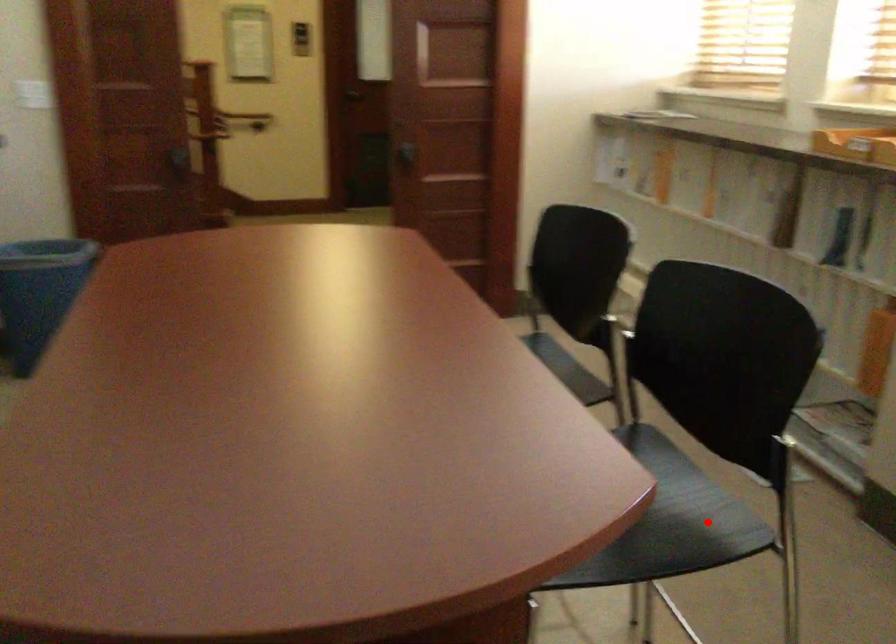
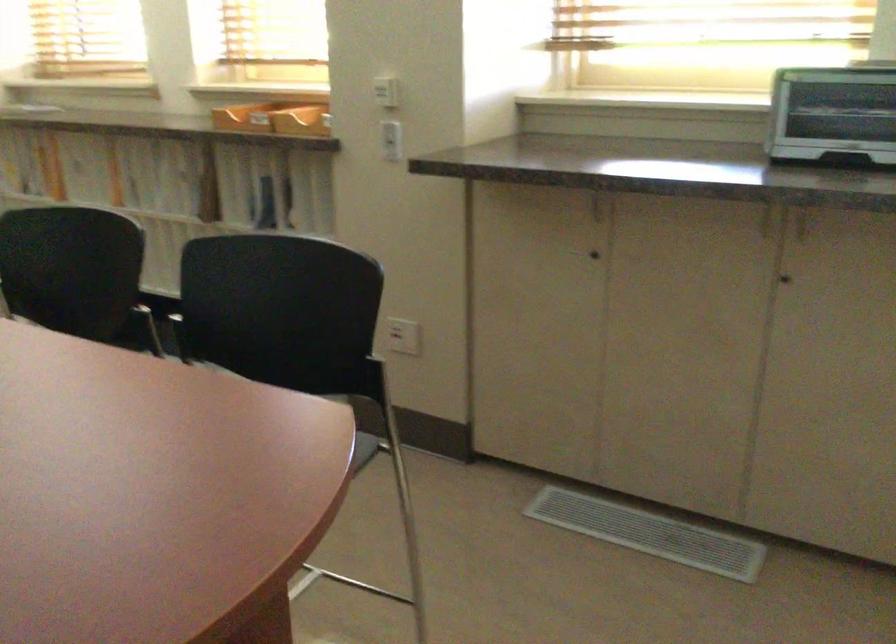
Question: I am providing you with two images of the same scene from different viewpoints. A red point is marked on the first image. Can you still see the location of the red point in image 2?

Choices:
 (A) Yes
 (B) No

Answer: (B)